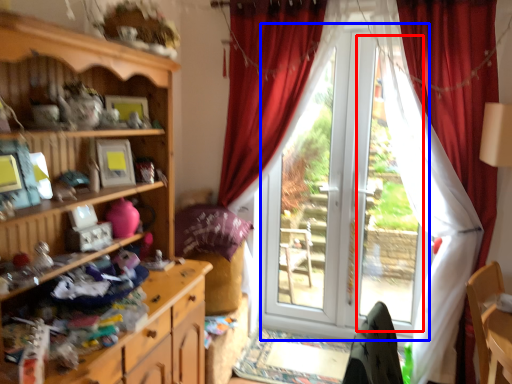
Question: Which object appears farthest to the camera in this image, bay window (highlighted by a red box) or screen door (highlighted by a blue box)?

Choices:
 (A) bay window
 (B) screen door

Answer: (A)